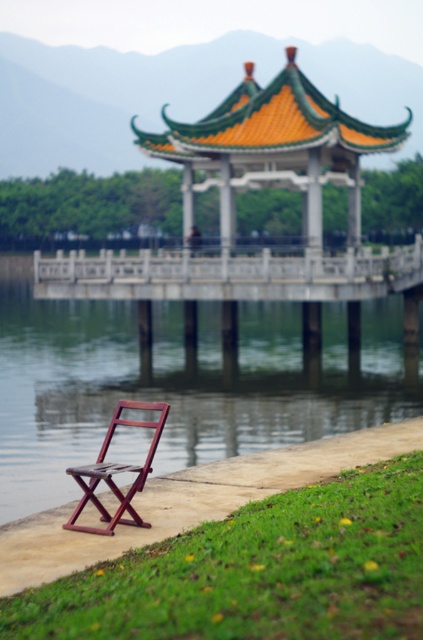
You are a visitor standing on the concrete pathway near the mahogany wood folding chair at lower left. You want to walk towards the green glazed tiles at center. Which direction should you move in?

You should move to the right to reach the green glazed tiles at center from the mahogany wood folding chair at lower left because the green glazed tiles at center are located to the right of the mahogany wood folding chair at lower left.

You are planning to place a small potted plant between the transparent water at chair left and the mahogany wood folding chair at lower left. Based on their sizes, which object should the plant be closer to?

The transparent water at chair left has a larger size compared to the mahogany wood folding chair at lower left, so the plant should be placed closer to the mahogany wood folding chair at lower left to maintain balance.

You are planning to place a small decorative stone on the path near the wooden folding chair. The stone is 1 meter wide. The transparent water at chair left and green glazed tiles at center are both on the path. Can the stone fit entirely on either of these areas without overlapping?

The transparent water at chair left is wider than the green glazed tiles at center. Since the stone is 1 meter wide, it can fit on the transparent water at chair left if its width is sufficient, but not on the green glazed tiles at center which are narrower.